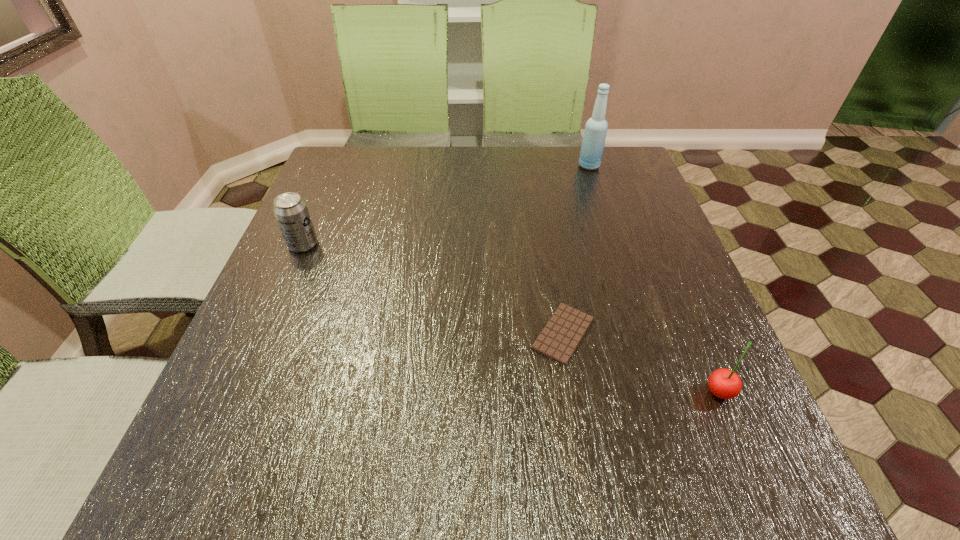
At what (x,y) coordinates should I click in order to perform the action: click on free region at the right edge. Please return your answer as a coordinate pair (x, y). Image resolution: width=960 pixels, height=540 pixels. Looking at the image, I should click on (696, 327).

In the image, there is a desktop. Where is `vacant space at the far left corner`? This screenshot has height=540, width=960. vacant space at the far left corner is located at coordinates (345, 151).

The image size is (960, 540). In order to click on free space at the far right corner of the desktop in this screenshot , I will do `click(609, 171)`.

Find the location of a particular element. This screenshot has width=960, height=540. empty space that is in between the cherry and the third shortest object is located at coordinates (511, 318).

Find the location of a particular element. vacant space that is in between the third nearest object and the second nearest object is located at coordinates (433, 289).

At what (x,y) coordinates should I click in order to perform the action: click on vacant space in between the third nearest object and the shortest object. Please return your answer as a coordinate pair (x, y). This screenshot has width=960, height=540. Looking at the image, I should click on (433, 289).

Where is `blank region between the third object from right to left and the nearest object`? Image resolution: width=960 pixels, height=540 pixels. blank region between the third object from right to left and the nearest object is located at coordinates (641, 362).

Find the location of a particular element. Image resolution: width=960 pixels, height=540 pixels. free space between the second shortest object and the chocolate bar is located at coordinates (641, 362).

Locate an element on the screen. The image size is (960, 540). vacant space that is in between the second nearest object and the bottle is located at coordinates (576, 250).

Find the location of a particular element. vacant region between the third nearest object and the second object from right to left is located at coordinates (446, 205).